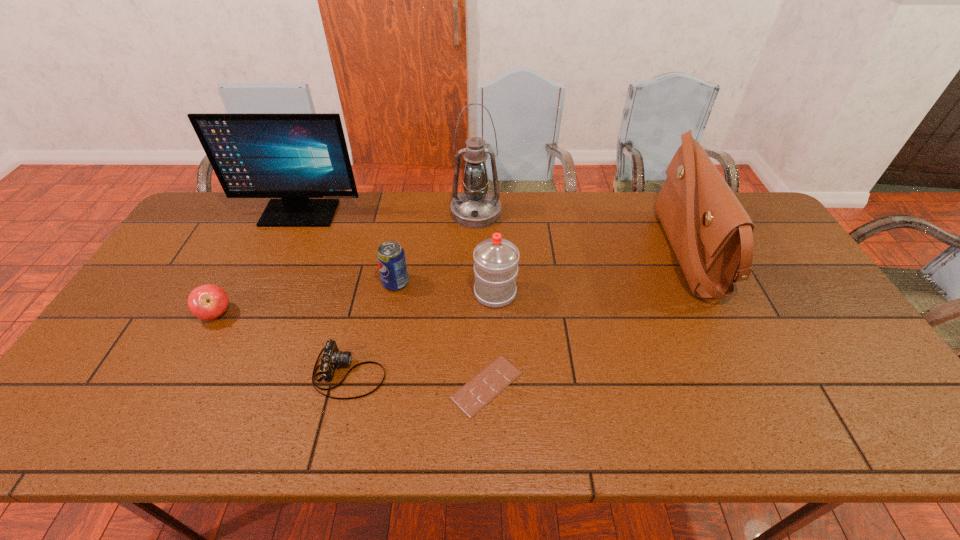
You are a GUI agent. You are given a task and a screenshot of the screen. Output one action in this format:
    pyautogui.click(x=<x>, y=<y>)
    Task: Click on the vacant space at the right edge of the desktop
    The height and width of the screenshot is (540, 960).
    Given the screenshot: What is the action you would take?
    pyautogui.click(x=815, y=342)

In order to click on vacant space at the far left corner in this screenshot , I will do `click(219, 201)`.

In the image, there is a desktop. Where is `vacant space at the near right corner`? This screenshot has height=540, width=960. vacant space at the near right corner is located at coordinates (863, 434).

Where is `unoccupied position between the apple and the camera`? unoccupied position between the apple and the camera is located at coordinates (283, 343).

Identify the location of vacant area that lies between the oil lamp and the fourth shortest object. This screenshot has height=540, width=960. (436, 247).

Identify the location of free spot between the oil lamp and the fourth shortest object. This screenshot has height=540, width=960. tap(436, 247).

Identify the location of free space between the apple and the camera. (283, 343).

Locate an element on the screen. The image size is (960, 540). vacant point located between the sixth tallest object and the fifth tallest object is located at coordinates (306, 298).

This screenshot has height=540, width=960. I want to click on free spot between the water bottle and the shortest object, so click(491, 339).

The width and height of the screenshot is (960, 540). What are the coordinates of `empty location between the oil lamp and the soda` in the screenshot? It's located at (436, 247).